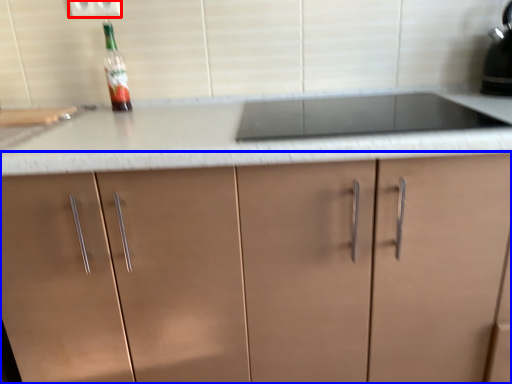
Question: Among these objects, which one is farthest to the camera, electric outlet (highlighted by a red box) or cabinetry (highlighted by a blue box)?

Choices:
 (A) electric outlet
 (B) cabinetry

Answer: (A)